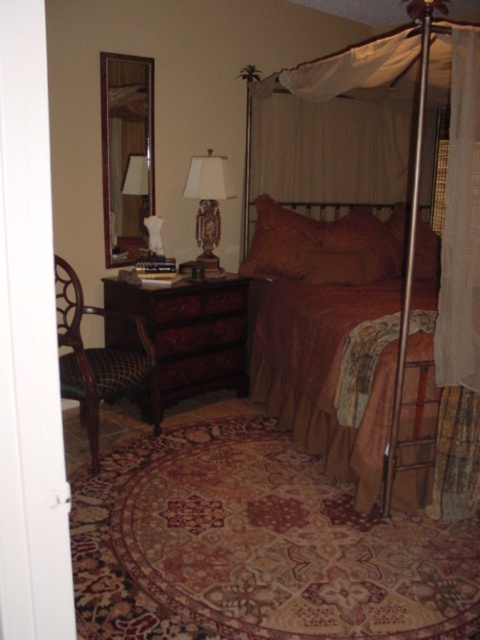
You are organizing a bedroom and need to place a new decorative vase between the mahogany wood dresser at center left and the brown wood drawer at center. Based on their positions, which object should the vase be closer to?

The vase should be placed closer to the mahogany wood dresser at center left because it is positioned to the left of the brown wood drawer at center, so the space between them would naturally place the vase nearer to the dresser.

You are trying to decide whether to place a new decorative item on the sheer white curtain at right or the brown textured pillow at center. Considering their sizes, which surface can accommodate a larger item?

The brown textured pillow at center has a greater width than the sheer white curtain at right, so it can accommodate a larger decorative item.

You are a painter standing in the bedroom and want to hang a picture frame that is 1.5 meters tall on the wall behind the matte brown fabric canopy bed at center and the matte brown wood lamp at center. Considering their heights, which object would require you to place the frame higher to avoid blocking it?

The matte brown fabric canopy bed at center is taller than the matte brown wood lamp at center, so you would need to place the frame higher to avoid blocking the bed.